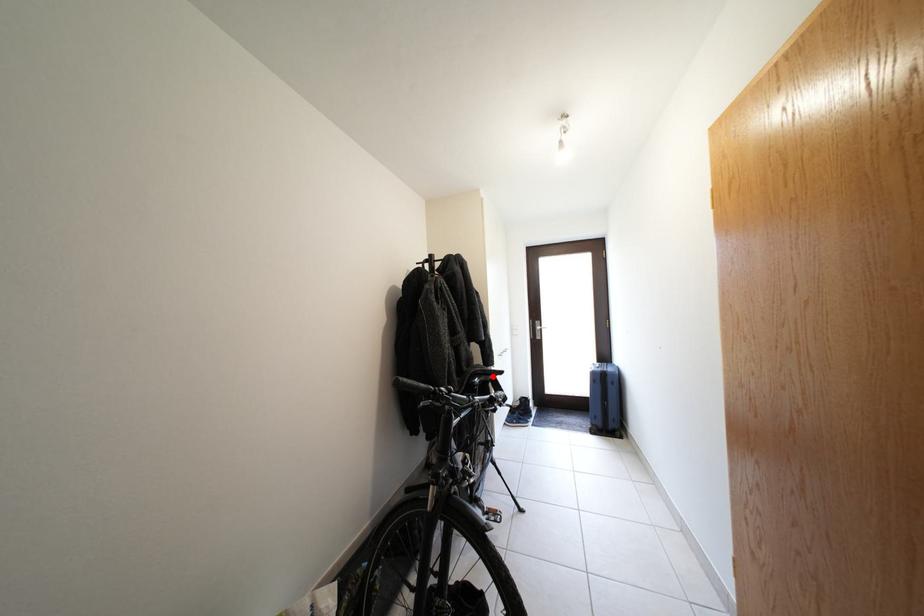
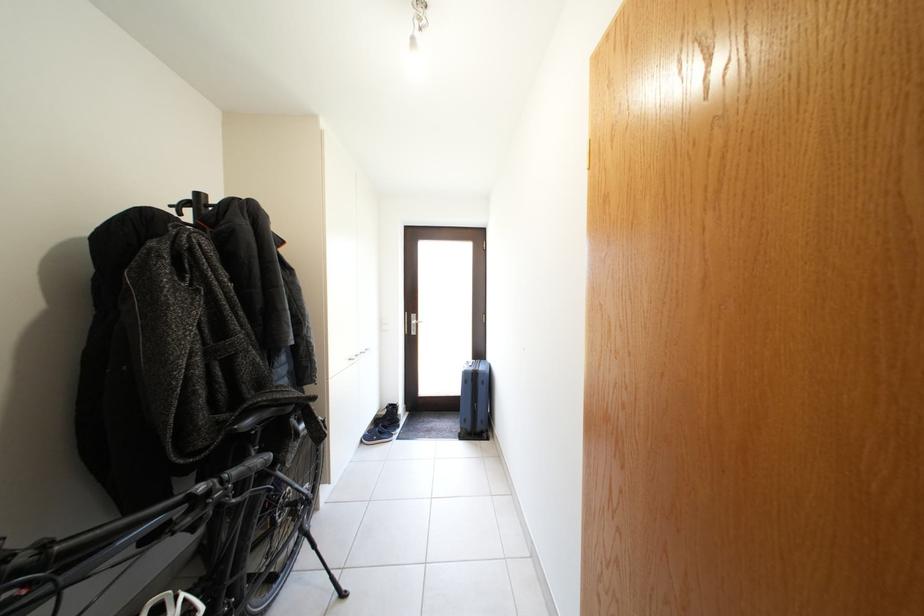
Question: I am providing you with two images of the same scene from different viewpoints. A red point is shown in image1. For the corresponding object point in image2, is it positioned nearer or farther from the camera?

Choices:
 (A) Nearer
 (B) Farther

Answer: (A)